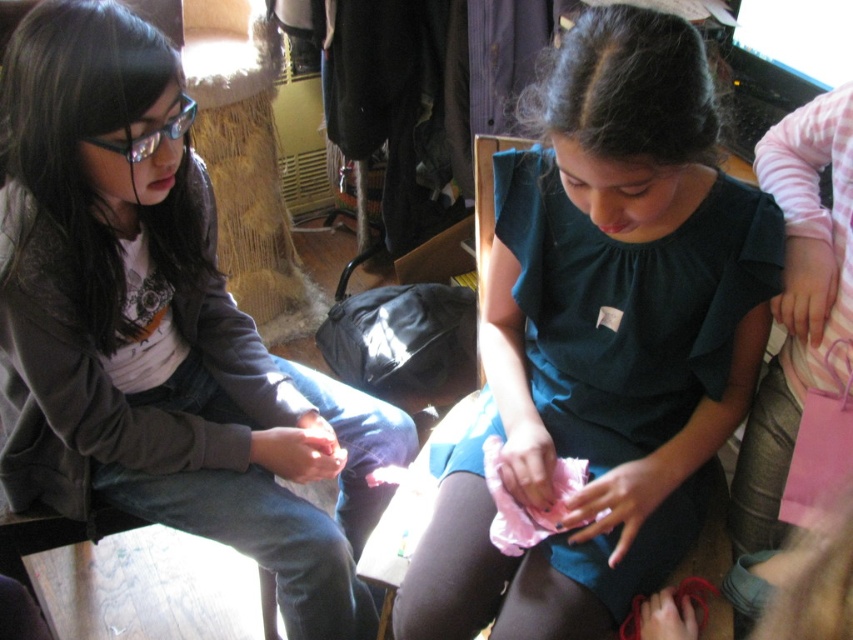
You are standing at the entrance of the room and want to approach the dark green fabric dress at center. Based on its coordinates, in which direction should you move from your current position?

The dark green fabric dress at center is located at coordinates point (602, 339), so you should move forward and slightly to the right to reach it.

You are organizing a clothing display and need to place the dark green fabric dress at center and the matte black jacket at left on adjacent hangers. Which clothing item requires a narrower hanger?

The dark green fabric dress at center requires a narrower hanger because it has a lesser width compared to the matte black jacket at left.